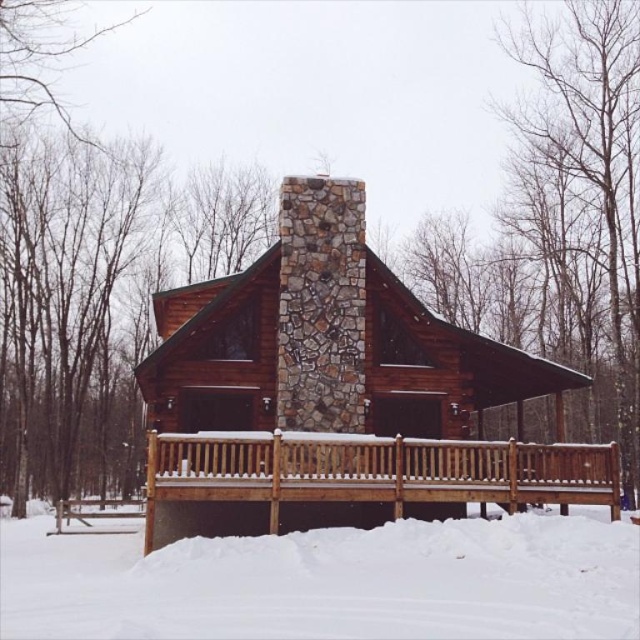
Question: Which point appears farthest from the camera in this image?

Choices:
 (A) (83, 627)
 (B) (499, 460)

Answer: (B)

Question: Is white fluffy snow at lower center to the left of brown wooden deck at lower center from the viewer's perspective?

Choices:
 (A) no
 (B) yes

Answer: (B)

Question: In this image, where is white fluffy snow at lower center located relative to brown wooden deck at lower center?

Choices:
 (A) left
 (B) right

Answer: (A)

Question: Can you confirm if white fluffy snow at lower center is wider than brown wooden deck at lower center?

Choices:
 (A) no
 (B) yes

Answer: (B)

Question: Among these objects, which one is nearest to the camera?

Choices:
 (A) brown wooden deck at lower center
 (B) white fluffy snow at lower center

Answer: (B)

Question: Which of the following is the farthest from the observer?

Choices:
 (A) brown wooden deck at lower center
 (B) white fluffy snow at lower center

Answer: (A)